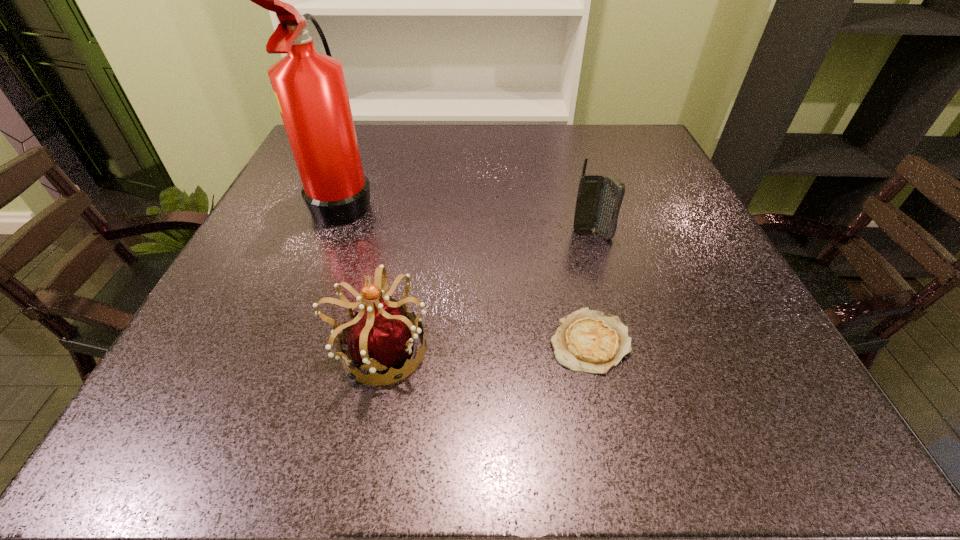
Where is `vacant space that is in between the cellular telephone and the tiara`? vacant space that is in between the cellular telephone and the tiara is located at coordinates (486, 292).

Find the location of a particular element. This screenshot has width=960, height=540. free area in between the cellular telephone and the fire extinguisher is located at coordinates (468, 217).

Identify the location of vacant space that's between the quiche and the tallest object. (467, 271).

Image resolution: width=960 pixels, height=540 pixels. Find the location of `vacant area between the tiara and the cellular telephone`. vacant area between the tiara and the cellular telephone is located at coordinates (486, 292).

Where is `free spot between the tiara and the shortest object`? This screenshot has height=540, width=960. free spot between the tiara and the shortest object is located at coordinates (485, 346).

Image resolution: width=960 pixels, height=540 pixels. What are the coordinates of `object that is the second closest to the quiche` in the screenshot? It's located at (381, 335).

This screenshot has height=540, width=960. I want to click on object that is the closest to the tallest object, so click(381, 335).

The height and width of the screenshot is (540, 960). Find the location of `vacant area that satisfies the following two spatial constraints: 1. on the keyboard of the cellular telephone; 2. on the front-facing side of the tiara`. vacant area that satisfies the following two spatial constraints: 1. on the keyboard of the cellular telephone; 2. on the front-facing side of the tiara is located at coordinates (626, 350).

You are a GUI agent. You are given a task and a screenshot of the screen. Output one action in this format:
    pyautogui.click(x=<x>, y=<y>)
    Task: Click on the vacant point that satisfies the following two spatial constraints: 1. on the keyboard of the cellular telephone; 2. on the front-facing side of the tiara
    The width and height of the screenshot is (960, 540).
    Given the screenshot: What is the action you would take?
    pyautogui.click(x=626, y=350)

The height and width of the screenshot is (540, 960). I want to click on free location that satisfies the following two spatial constraints: 1. on the keyboard of the cellular telephone; 2. on the front-facing side of the tiara, so click(x=626, y=350).